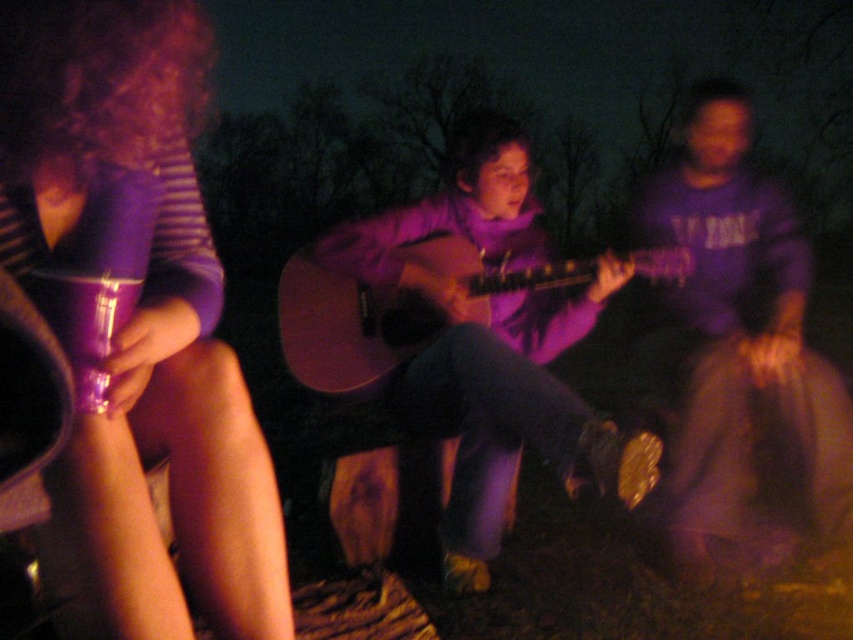
You are setting up a small table for two guests. You have a matte purple cup at left and a matte acoustic guitar at center. If you need to place both items on the table, which one should you place first to ensure they both fit?

The matte purple cup at left has a smaller width than the matte acoustic guitar at center, so you should place the matte acoustic guitar at center first to ensure both items fit on the table.

You are a photographer trying to capture the purple matte guitar at center in your shot. If your camera has a focus point at coordinates 0.541, 0.578, will it align perfectly with the guitar?

Yes, the purple matte guitar at center is exactly at the coordinates (492, 346), so the camera focus point will align perfectly with the guitar.

You are organizing a campfire event and need to place a 4.5 feet long banner between the matte purple cup at left and the matte acoustic guitar at center. Will the banner fit exactly between them?

The matte purple cup at left and matte acoustic guitar at center are 4.45 feet apart from each other. Since the banner is 4.5 feet long, it is slightly longer than the distance between them, so it won comparison to fit exactly.